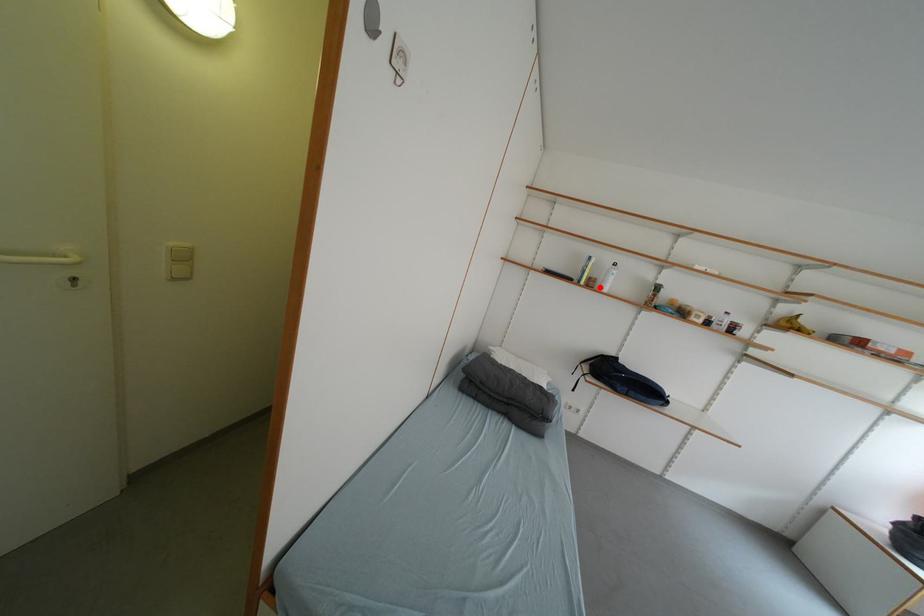
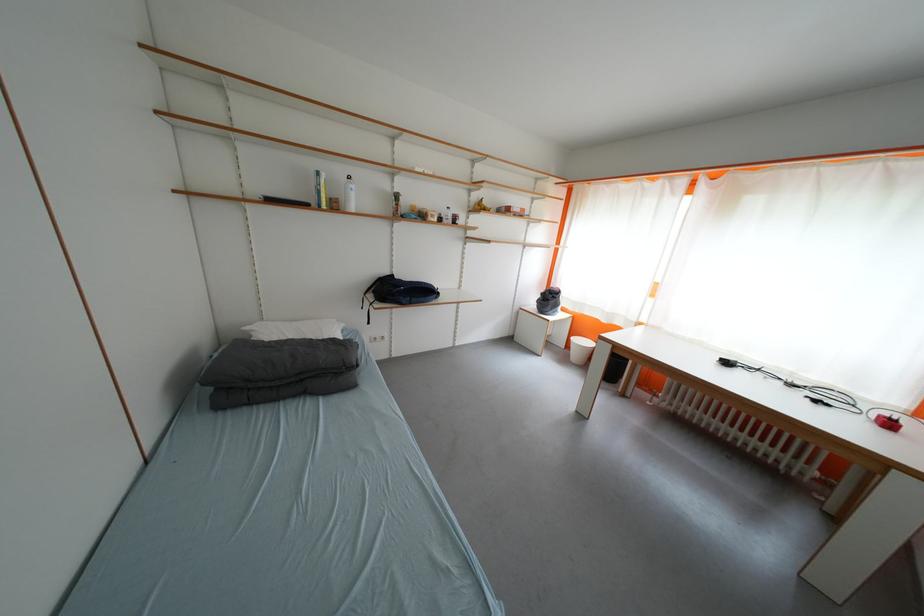
In the second image, find the point that corresponds to the highlighted location in the first image.

(344, 209)